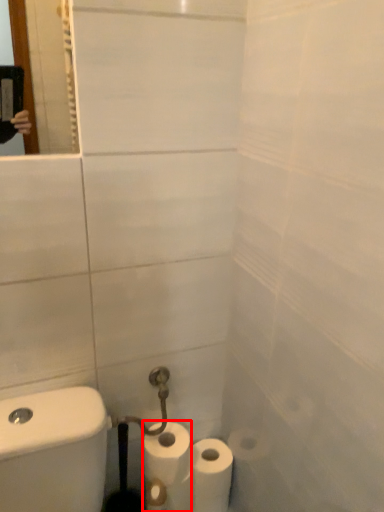
Question: From the image's perspective, where is toilet paper (annotated by the red box) located in relation to toilet paper in the image?

Choices:
 (A) below
 (B) above

Answer: (B)